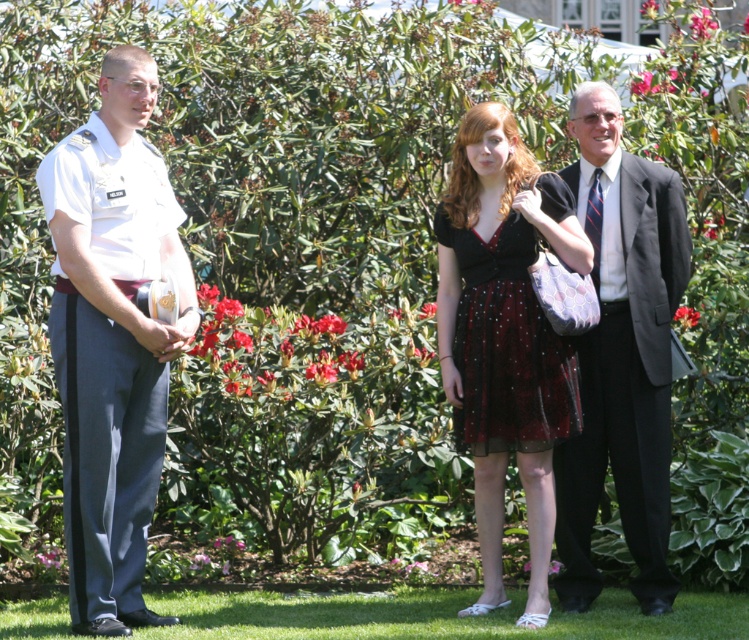
Based on the coordinates provided, which object is located at point (x=112, y=339)?

The point (x=112, y=339) marks the white uniform at left.

You are a photographer at this event and need to adjust the camera settings to capture both the velvet dress at center and the dark gray suit at center in focus. The camera has a depth of field that can cover 14 inches. Will the current setting work?

The velvet dress at center is 13.84 inches away from the dark gray suit at center. Since the distance between them is less than the 14 inches depth of field, the current camera setting will work to keep both in focus.